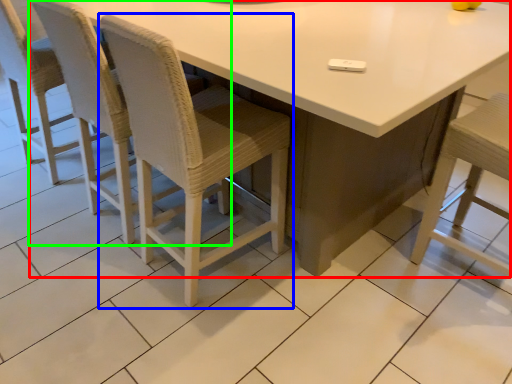
Question: Estimate the real-world distances between objects in this image. Which object is farther from table (highlighted by a red box), chair (highlighted by a blue box) or chair (highlighted by a green box)?

Choices:
 (A) chair
 (B) chair

Answer: (B)